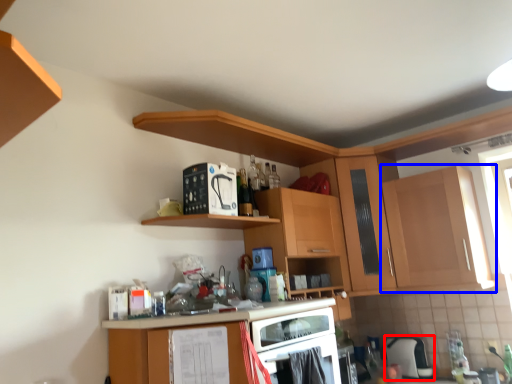
Question: Which point is further to the camera, appliance (highlighted by a red box) or cabinetry (highlighted by a blue box)?

Choices:
 (A) appliance
 (B) cabinetry

Answer: (A)